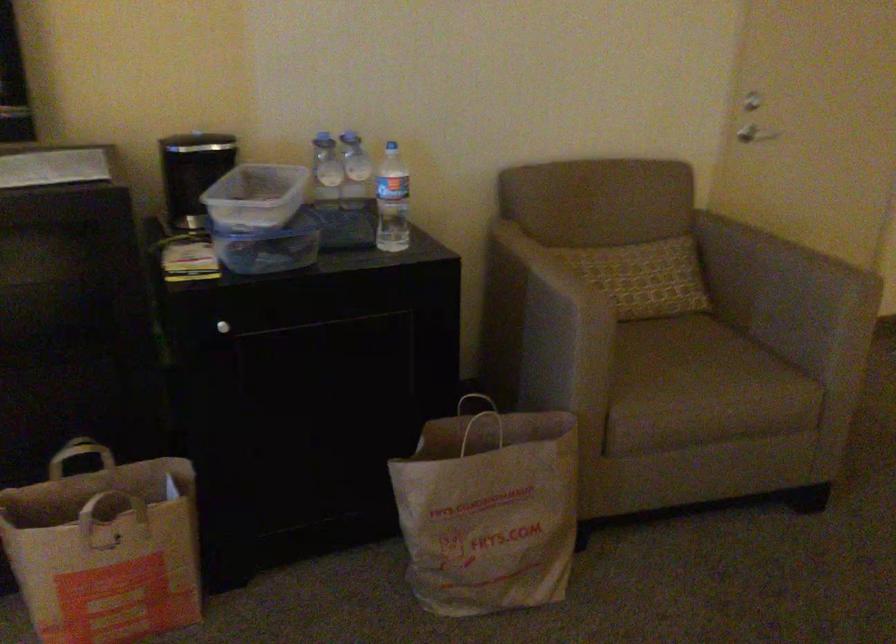
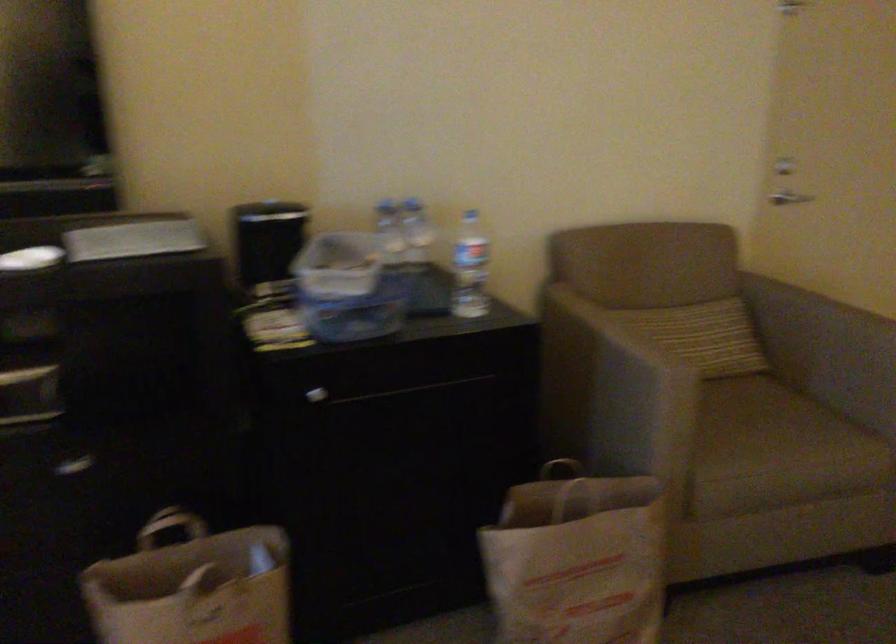
The point at (x=745, y=250) is marked in the first image. Where is the corresponding point in the second image?

(807, 308)